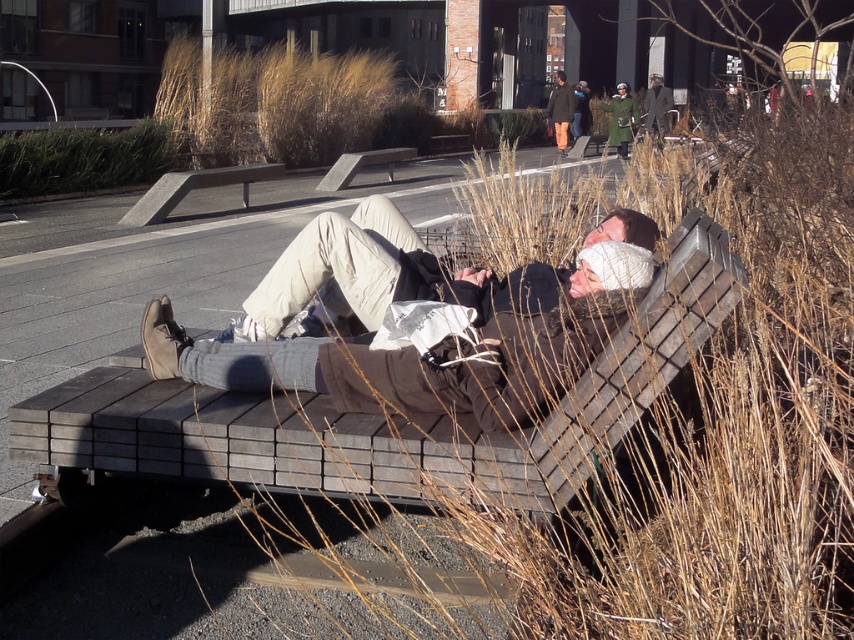
In the scene shown: Which is more to the left, wooden bench at center or dark brown leather coat at upper center?

Positioned to the left is wooden bench at center.

At what (x,y) coordinates should I click in order to perform the action: click on wooden bench at center. Please return your answer as a coordinate pair (x, y). The image size is (854, 640). Looking at the image, I should click on [379, 416].

Does point (677, 355) come in front of point (559, 72)?

Yes, point (677, 355) is closer to viewer.

The height and width of the screenshot is (640, 854). Identify the location of wooden bench at center. (379, 416).

Is point (155, 182) positioned before point (610, 106)?

Yes.

This screenshot has width=854, height=640. In order to click on smooth gray bench at center in this screenshot , I will do `click(194, 188)`.

At what (x,y) coordinates should I click in order to perform the action: click on smooth gray bench at center. Please return your answer as a coordinate pair (x, y). This screenshot has width=854, height=640. Looking at the image, I should click on (194, 188).

Which is behind, point (355, 161) or point (551, 108)?

The point (551, 108) is behind.

Does wooden park bench at center have a lesser height compared to dark brown leather coat at upper center?

Yes, wooden park bench at center is shorter than dark brown leather coat at upper center.

Between point (392, 168) and point (565, 150), which one is positioned in front?

Positioned in front is point (392, 168).

Where is `wooden park bench at center`? This screenshot has width=854, height=640. wooden park bench at center is located at coordinates (361, 164).